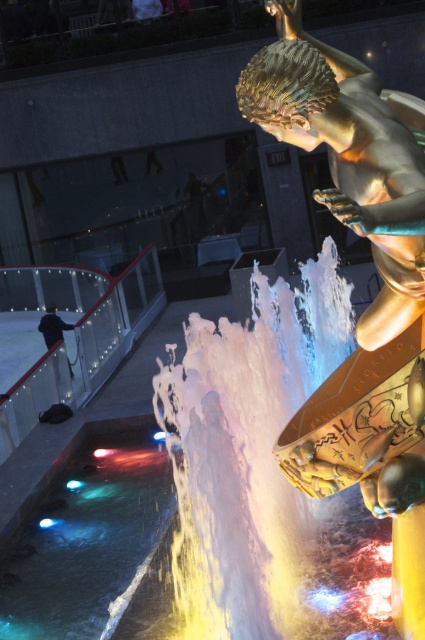
Question: Which point is closer to the camera?

Choices:
 (A) tap(65, 480)
 (B) tap(379, 314)
 (C) tap(64, 330)

Answer: (B)

Question: Considering the real-world distances, which object is closest to the gold metallic statue at center?

Choices:
 (A) dark blue fabric jacket at left
 (B) translucent glass water at lower left

Answer: (B)

Question: Does translucent glass water at lower left appear over dark blue fabric jacket at left?

Choices:
 (A) yes
 (B) no

Answer: (B)

Question: From the image, what is the correct spatial relationship of gold metallic statue at center in relation to translucent glass water at lower left?

Choices:
 (A) above
 (B) below

Answer: (A)

Question: From the image, what is the correct spatial relationship of gold metallic statue at center in relation to translucent glass water at lower left?

Choices:
 (A) left
 (B) right

Answer: (B)

Question: Which point is farther to the camera?

Choices:
 (A) dark blue fabric jacket at left
 (B) gold metallic statue at center

Answer: (A)